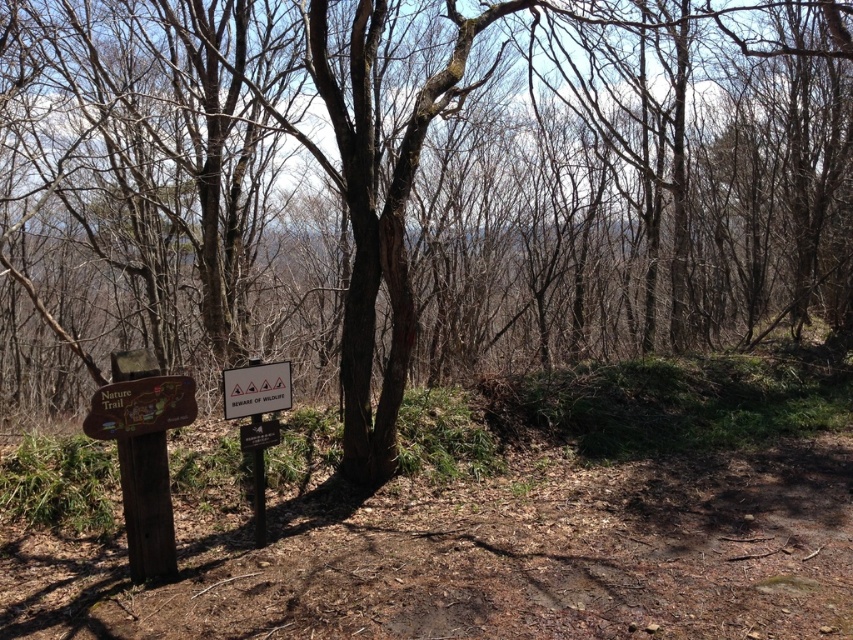
You are standing at the point marked by the wooden signpost in the forest scene. A hiker wants to know how far they are from the point labeled with coordinates (177, 380). Can you tell them the distance?

The point labeled with coordinates (177, 380) is 4.37 meters away from the viewer, so the hiker is 4.37 meters away from that point.

You are standing in the forest and want to locate the wooden sign at left. According to the scene description, where would you find it in terms of its position relative to the center of the image?

The wooden sign at left is located at the 2D coordinates point (140, 406), which places it slightly to the right and lower than the center of the image.

You are a hiker trying to determine the best path to avoid obstacles. You notice two points marked on the map displayed on the Nature Trail sign. The first point is at coordinates point (115, 365) and the second is at point (257, 436). Which point is closer to your current position?

Point (115, 365) is closer to the camera than point (257, 436), so the first point is closer to your current position.